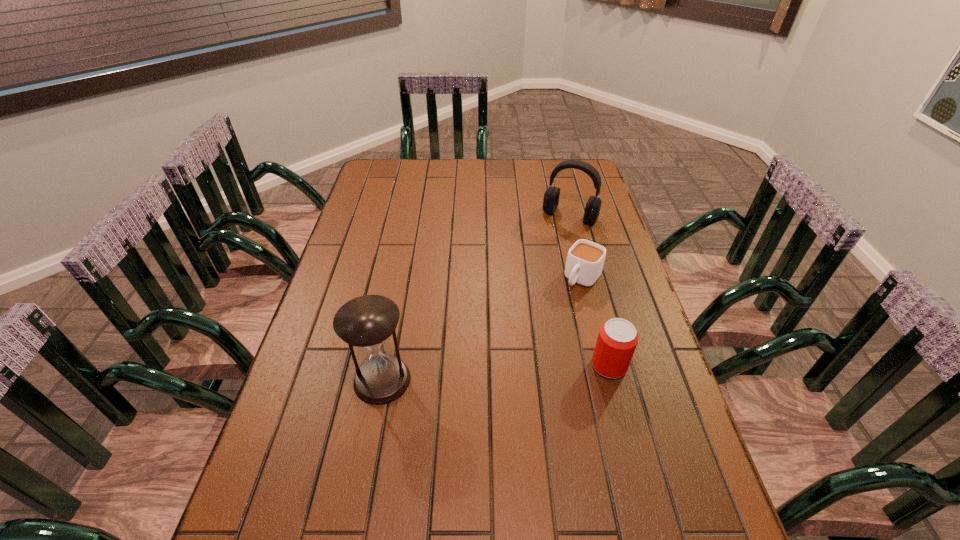
You are a GUI agent. You are given a task and a screenshot of the screen. Output one action in this format:
    pyautogui.click(x=<x>, y=<y>)
    Task: Click on the free space that is in between the farthest object and the leftmost object
    The image size is (960, 540).
    Given the screenshot: What is the action you would take?
    pyautogui.click(x=476, y=298)

Identify which object is the second nearest to the beer can. Please provide its 2D coordinates. Your answer should be formatted as a tuple, i.e. [(x, y)], where the tuple contains the x and y coordinates of a point satisfying the conditions above.

[(367, 322)]

Select which object is the third closest to the third nearest object. Please provide its 2D coordinates. Your answer should be formatted as a tuple, i.e. [(x, y)], where the tuple contains the x and y coordinates of a point satisfying the conditions above.

[(367, 322)]

In order to click on free location that satisfies the following two spatial constraints: 1. on the back side of the cup; 2. on the left side of the farthest object in this screenshot , I will do `click(567, 216)`.

This screenshot has height=540, width=960. In order to click on vacant area in the image that satisfies the following two spatial constraints: 1. on the front side of the farthest object; 2. on the left side of the second shortest object in this screenshot , I will do `click(608, 366)`.